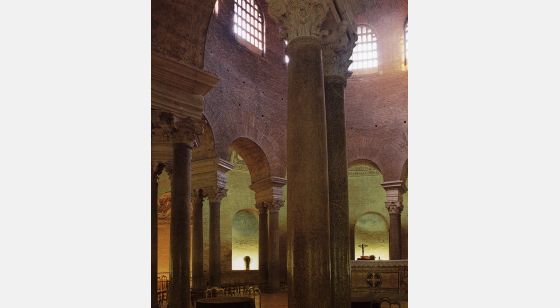
You are a GUI agent. You are given a task and a screenshot of the screen. Output one action in this format:
    pyautogui.click(x=<x>, y=<y>)
    Task: Click on the column
    
    Given the screenshot: What is the action you would take?
    pyautogui.click(x=311, y=159)